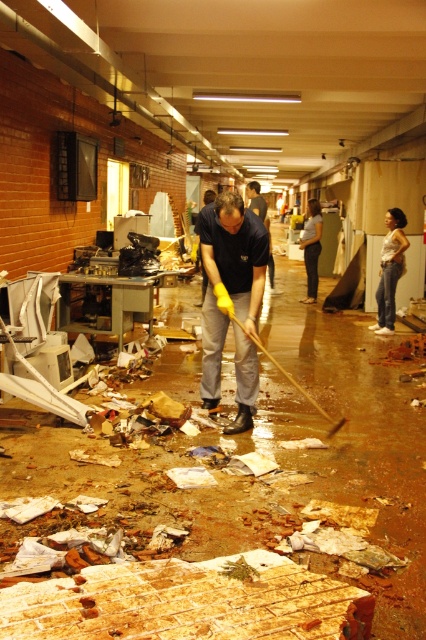
You are standing at the point marked as point (389, 269). What is the color of the shirt worn by the person closest to you?

The person closest to you at point (389, 269) is wearing a white cotton shirt.

You are a safety inspector in the warehouse and need to ensure that all equipment is properly sized for workers. You notice the white cotton shirt at center and the yellow rubber shovel at center. Which object is smaller?

The white cotton shirt at center is smaller than the yellow rubber shovel at center.

You are a safety inspector in the warehouse and need to retrieve the yellow rubber shovel at center. The matte blue shirt at center belongs to a worker currently sweeping. Can you safely reach the shovel without disturbing the worker?

The yellow rubber shovel at center is behind matte blue shirt at center, so you can safely retrieve it without disturbing the worker by going around the worker from the side or back.